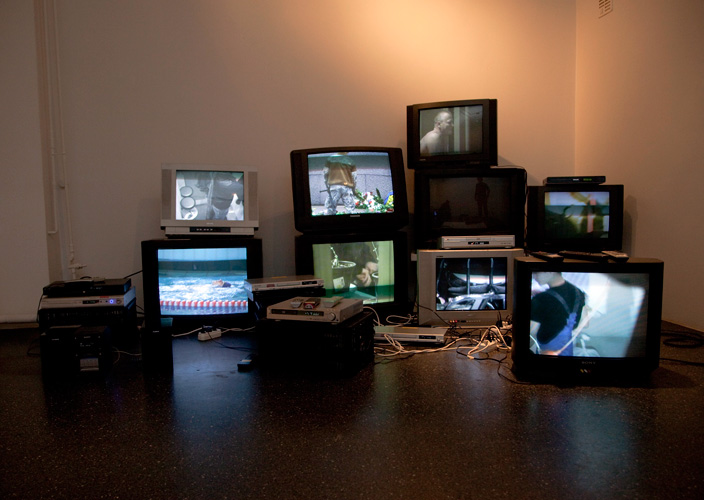
Where is `wires`? wires is located at coordinates (440, 349).